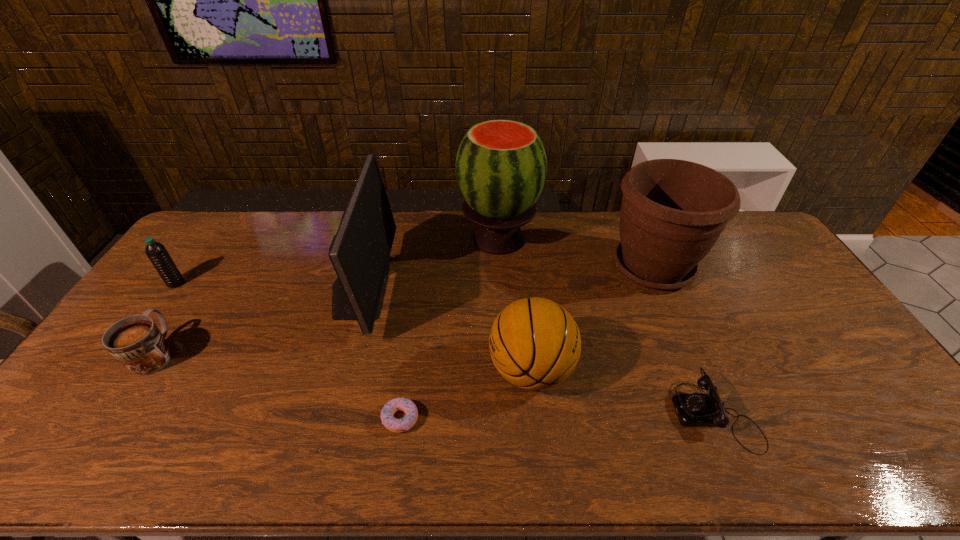
I want to click on mug present at the left edge, so click(x=136, y=342).

In the image, there is a desktop. Identify the location of free space at the far edge. (563, 215).

Where is `vacant space at the near edge of the desktop`? This screenshot has width=960, height=540. vacant space at the near edge of the desktop is located at coordinates (196, 472).

In the image, there is a desktop. Where is `vacant space at the left edge`? The width and height of the screenshot is (960, 540). vacant space at the left edge is located at coordinates (214, 256).

This screenshot has width=960, height=540. I want to click on free spot between the watermelon and the second object from left to right, so click(327, 296).

Locate an element on the screen. Image resolution: width=960 pixels, height=540 pixels. free space between the basketball and the water bottle is located at coordinates (353, 327).

You are a GUI agent. You are given a task and a screenshot of the screen. Output one action in this format:
    pyautogui.click(x=<x>, y=<y>)
    Task: Click on the free space between the watermelon and the flowerpot
    
    Given the screenshot: What is the action you would take?
    tap(576, 253)

The image size is (960, 540). I want to click on free space between the basketball and the sixth object from right to left, so click(445, 328).

Where is `free space between the shortest object and the fifth tallest object`? free space between the shortest object and the fifth tallest object is located at coordinates (288, 350).

The height and width of the screenshot is (540, 960). I want to click on vacant point located between the second shortest object and the fourth tallest object, so click(x=623, y=392).